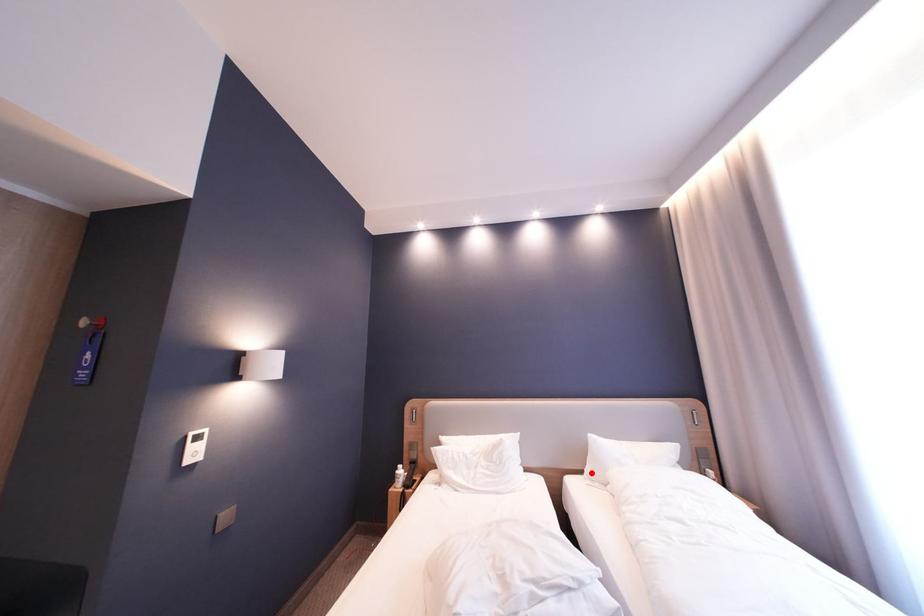
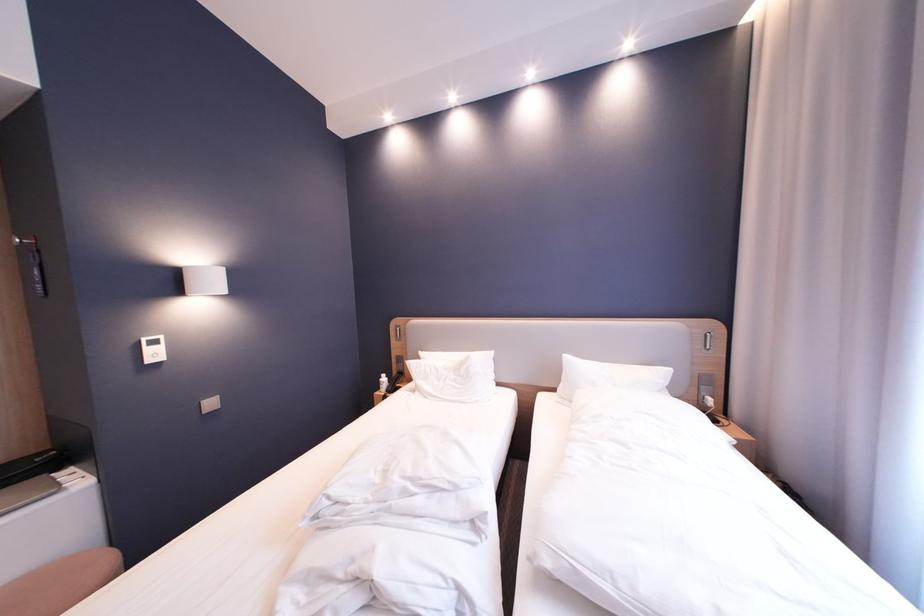
Question: I am providing you with two images of the same scene from different viewpoints. A red point is marked on the first image. Can you still see the location of the red point in image 2?

Choices:
 (A) Yes
 (B) No

Answer: (A)